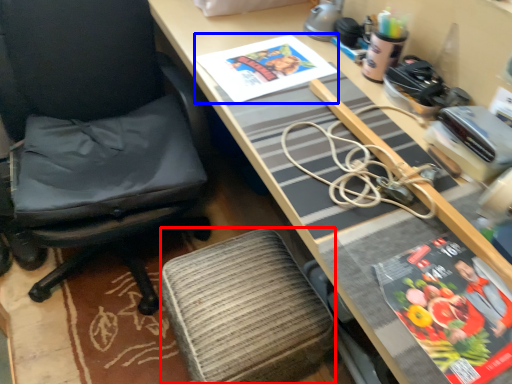
Question: Which object is closer to the camera taking this photo, stool (highlighted by a red box) or book cover (highlighted by a blue box)?

Choices:
 (A) stool
 (B) book cover

Answer: (A)